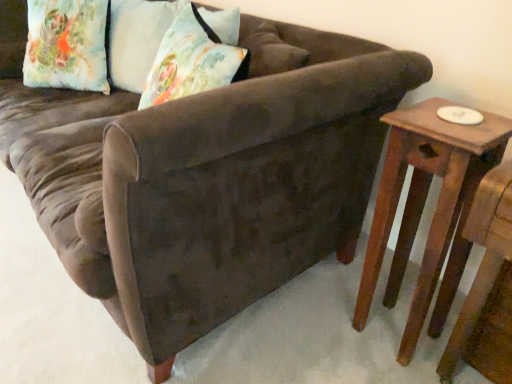
Question: Considering the relative sizes of floral fabric pillow at upper left, which is counted as the 1th pillow, starting from the right, and wooden side table at right in the image provided, is floral fabric pillow at upper left, which is counted as the 1th pillow, starting from the right, bigger than wooden side table at right?

Choices:
 (A) no
 (B) yes

Answer: (A)

Question: Can you confirm if floral fabric pillow at upper left, which is counted as the 1th pillow, starting from the right, is taller than wooden side table at right?

Choices:
 (A) yes
 (B) no

Answer: (B)

Question: Is floral fabric pillow at upper left, which is the 2th pillow in left-to-right order, not within wooden side table at right?

Choices:
 (A) no
 (B) yes

Answer: (B)

Question: Does floral fabric pillow at upper left, which is the 2th pillow in left-to-right order, have a smaller size compared to wooden side table at right?

Choices:
 (A) yes
 (B) no

Answer: (A)

Question: Does floral fabric pillow at upper left, which is counted as the 1th pillow, starting from the right, have a greater width compared to wooden side table at right?

Choices:
 (A) no
 (B) yes

Answer: (B)

Question: Is floral fabric pillow at upper left, which is the 2th pillow in left-to-right order, surrounding wooden side table at right?

Choices:
 (A) no
 (B) yes

Answer: (A)

Question: Is floral fabric pillow at upper left, which ranks as the first pillow in left-to-right order, bigger than floral fabric pillow at upper left, which is counted as the 1th pillow, starting from the right?

Choices:
 (A) yes
 (B) no

Answer: (A)

Question: Can you confirm if floral fabric pillow at upper left, which appears as the 2th pillow when viewed from the right, is positioned to the left of floral fabric pillow at upper left, which is the 2th pillow in left-to-right order?

Choices:
 (A) no
 (B) yes

Answer: (B)

Question: From a real-world perspective, is floral fabric pillow at upper left, which ranks as the first pillow in left-to-right order, on top of floral fabric pillow at upper left, which is counted as the 1th pillow, starting from the right?

Choices:
 (A) yes
 (B) no

Answer: (B)

Question: Does floral fabric pillow at upper left, which appears as the 2th pillow when viewed from the right, have a lesser height compared to floral fabric pillow at upper left, which is the 2th pillow in left-to-right order?

Choices:
 (A) no
 (B) yes

Answer: (A)

Question: From a real-world perspective, is floral fabric pillow at upper left, which appears as the 2th pillow when viewed from the right, physically below floral fabric pillow at upper left, which is the 2th pillow in left-to-right order?

Choices:
 (A) no
 (B) yes

Answer: (B)

Question: Does floral fabric pillow at upper left, which appears as the 2th pillow when viewed from the right, have a smaller size compared to floral fabric pillow at upper left, which is the 2th pillow in left-to-right order?

Choices:
 (A) no
 (B) yes

Answer: (A)

Question: From the image's perspective, is wooden side table at right under floral fabric pillow at upper left, which appears as the 2th pillow when viewed from the right?

Choices:
 (A) yes
 (B) no

Answer: (A)